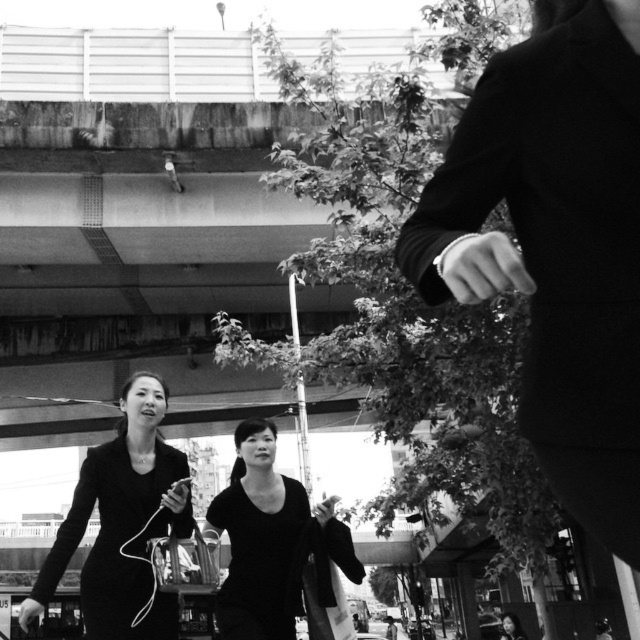
Which is below, black matte dress at center or smooth black dress at lower center?

smooth black dress at lower center is lower down.

Based on the photo, is black matte dress at center positioned at the back of smooth black dress at lower center?

No.

At what (x,y) coordinates should I click in order to perform the action: click on black matte dress at center. Please return your answer as a coordinate pair (x, y). The image size is (640, 640). Looking at the image, I should click on (273, 545).

Where is `black matte dress at center`? black matte dress at center is located at coordinates (273, 545).

Between matte black dress at center and black matte dress at center, which one appears on the left side from the viewer's perspective?

matte black dress at center

Measure the distance between matte black dress at center and black matte dress at center.

matte black dress at center and black matte dress at center are 22.19 inches apart.

Where is `matte black dress at center`? matte black dress at center is located at coordinates (122, 524).

The height and width of the screenshot is (640, 640). What do you see at coordinates (122, 524) in the screenshot?
I see `matte black dress at center` at bounding box center [122, 524].

Is matte black dress at center above smooth black dress at lower center?

Yes, matte black dress at center is above smooth black dress at lower center.

Image resolution: width=640 pixels, height=640 pixels. Describe the element at coordinates (122, 524) in the screenshot. I see `matte black dress at center` at that location.

At what (x,y) coordinates should I click in order to perform the action: click on matte black dress at center. Please return your answer as a coordinate pair (x, y). The height and width of the screenshot is (640, 640). Looking at the image, I should click on (122, 524).